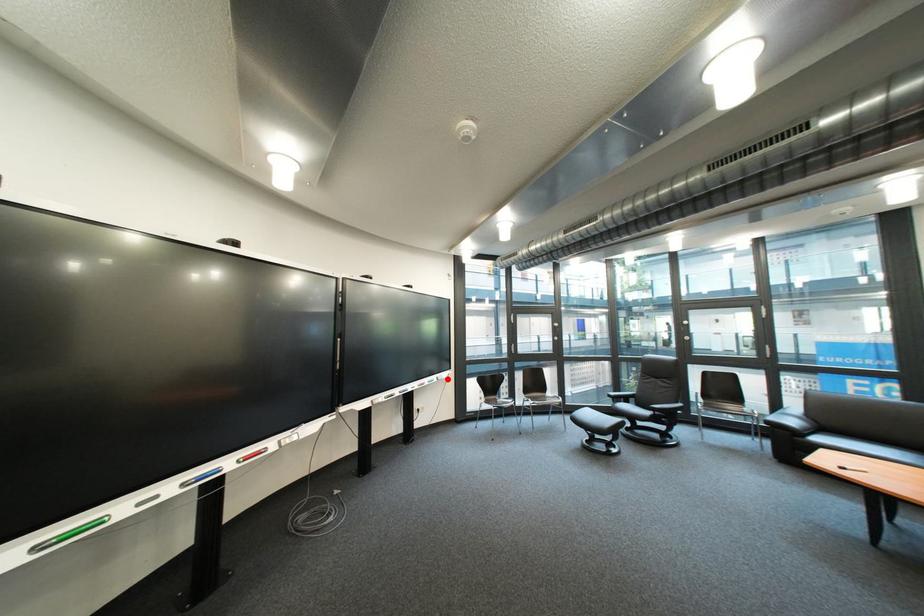
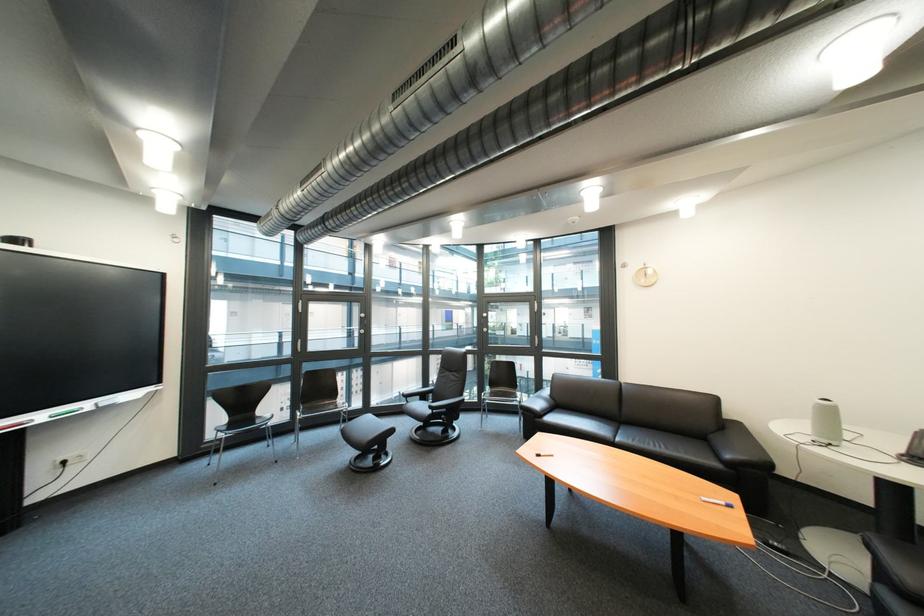
Question: I am providing you with two images of the same scene from different viewpoints. A red point is shown in image1. For the corresponding object point in image2, is it positioned nearer or farther from the camera?

Choices:
 (A) Nearer
 (B) Farther

Answer: (A)